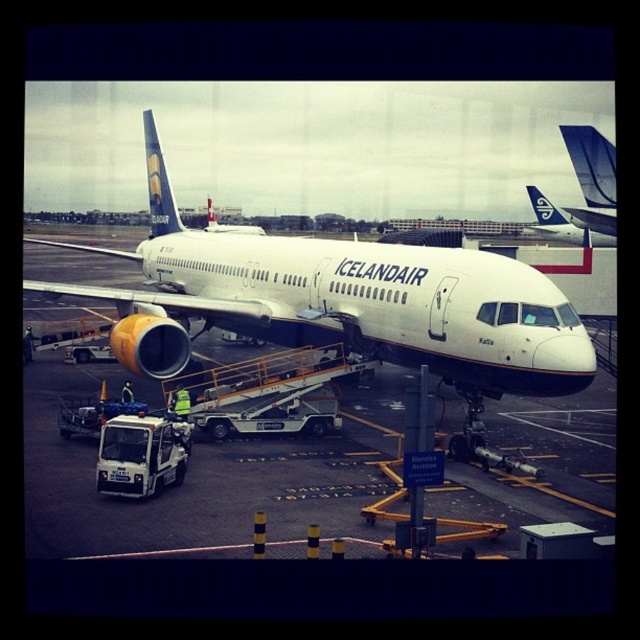
Question: Among these objects, which one is nearest to the camera?

Choices:
 (A) white matte airplane at center
 (B) white matte airplane at upper center

Answer: (A)

Question: Is white matte airplane at center to the right of white matte airplane at upper center from the viewer's perspective?

Choices:
 (A) no
 (B) yes

Answer: (A)

Question: Does white matte airplane at center appear over white matte airplane at upper center?

Choices:
 (A) yes
 (B) no

Answer: (B)

Question: Among these objects, which one is nearest to the camera?

Choices:
 (A) white matte airplane at upper center
 (B) white matte airplane at center

Answer: (B)

Question: Can you confirm if white matte airplane at center is thinner than white matte airplane at upper center?

Choices:
 (A) yes
 (B) no

Answer: (B)

Question: Which point is closer to the camera?

Choices:
 (A) (536, 189)
 (B) (419, 259)

Answer: (B)